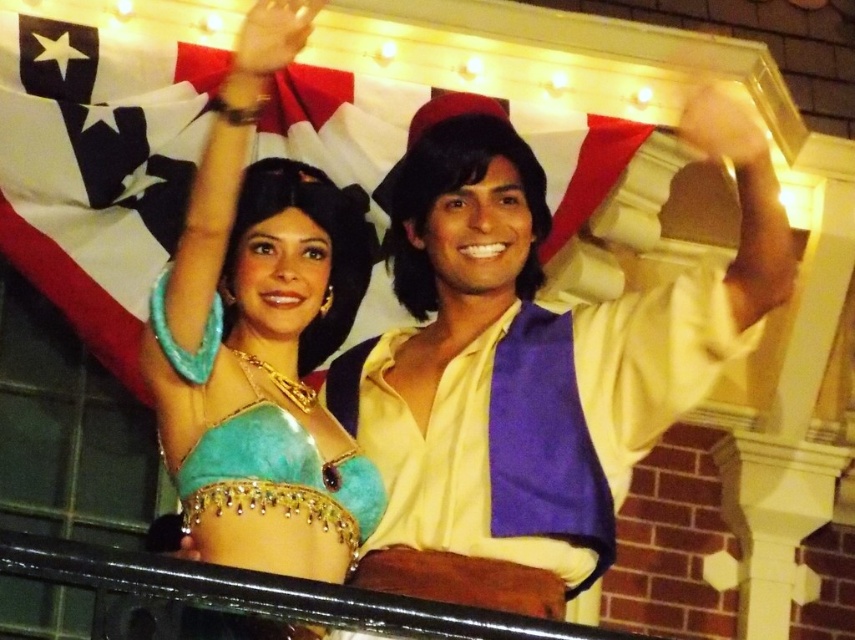
You are a photographer trying to capture a photo of the turquoise felt belly dancer costume at upper left and the white fabric flag at upper center. Which object is located to the right of the other?

The white fabric flag at upper center is positioned on the right side of turquoise felt belly dancer costume at upper left.

You are a photographer standing at the base of a tall building. You need to capture both the yellow satin shirt at center and the white fabric flag at upper center in a single photo. The camera you have can only focus on objects within a 30 feet range. Will both subjects be in focus?

The yellow satin shirt at center is 35.07 feet away from the white fabric flag at upper center. Since the camera can only focus within 30 feet, the distance between them exceeds the camera range. Therefore, both subjects cannot be in focus simultaneously.

You are a photographer trying to capture both the white fabric flag at upper center and the turquoise felt belly dancer costume at upper left in a single frame. Given that the flag is larger than the costume, which object should you position closer to the camera to ensure both fit well in the photo?

Since the white fabric flag at upper center is larger than the turquoise felt belly dancer costume at upper left, you should position the turquoise felt belly dancer costume at upper left closer to the camera to balance their sizes in the frame.